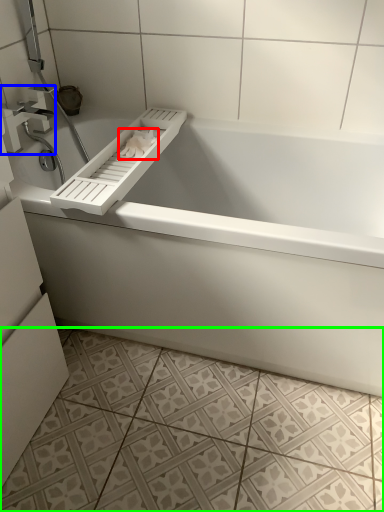
Question: Which is farther away from toilet paper (highlighted by a red box)? tap (highlighted by a blue box) or ceramic tile (highlighted by a green box)?

Choices:
 (A) tap
 (B) ceramic tile

Answer: (B)